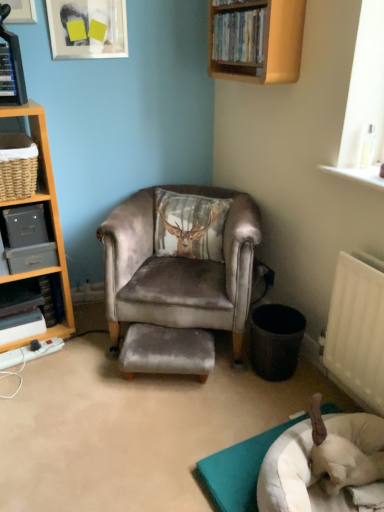
The height and width of the screenshot is (512, 384). Identify the location of free area in between velvet grey stool at center and black plastic trash can at lower right. point(238,374).